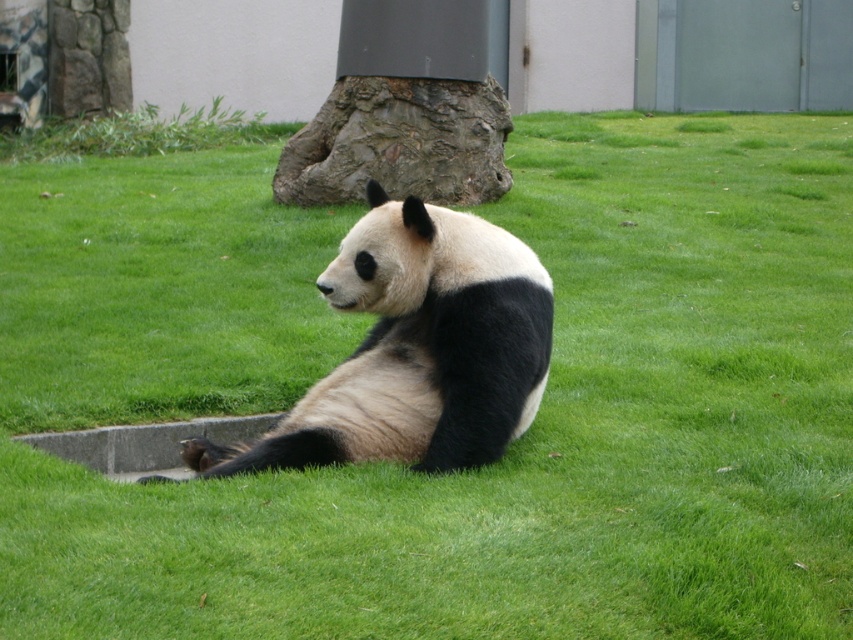
You are a wildlife photographer trying to capture a shot of the black fur panda at center and the rough bark tree trunk at center. You want to frame both subjects so that the panda is on the left side of the photo and the tree trunk is on the right side. Given their sizes, which subject should you place closer to the edge of the frame to ensure both fit comfortably?

Since the black fur panda at center is narrower than the rough bark tree trunk at center, you should place the rough bark tree trunk at center closer to the edge of the frame to accommodate its larger width while keeping the black fur panda at center centered or slightly shifted to the left.

You are a zookeeper who needs to place a feeding station between the black fur panda at center and the rough bark tree trunk at center. The feeding station requires a minimum of 3 meters of space. Can you fit it between them?

The distance between the black fur panda at center and the rough bark tree trunk at center is 5.28 meters. Since the feeding station requires a minimum of 3 meters, there is enough space to place it between them.